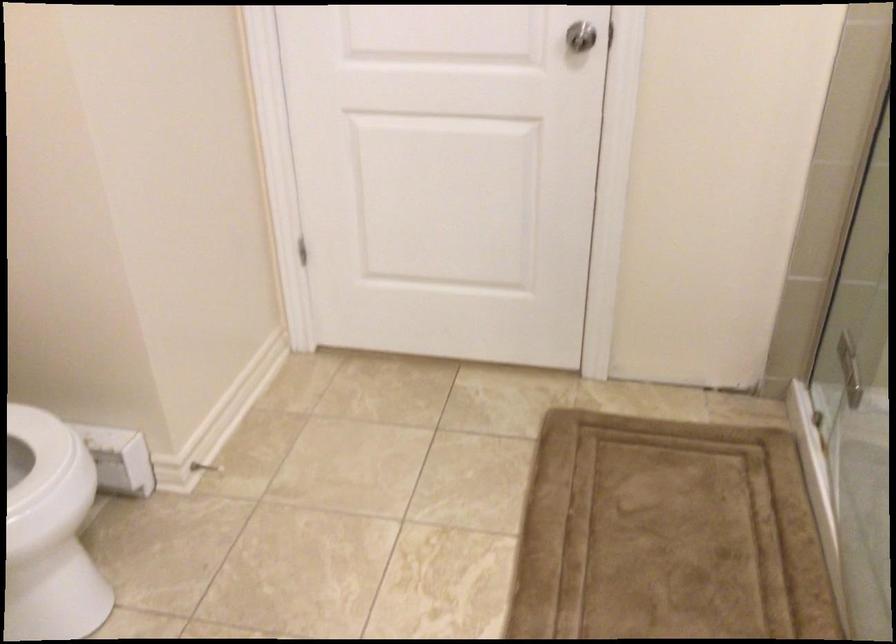
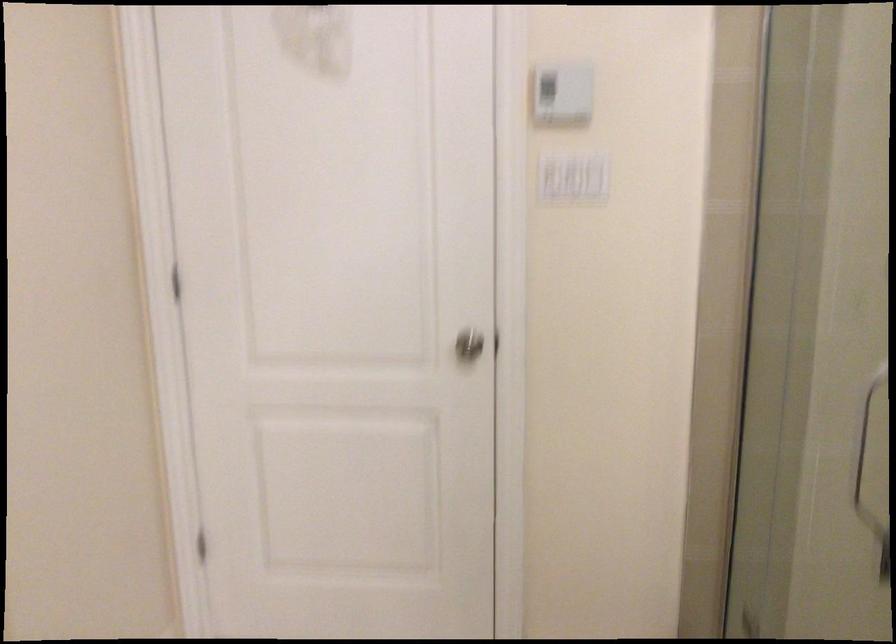
What movement of the cameraman would produce the second image?

The cameraman moved toward right, forward.